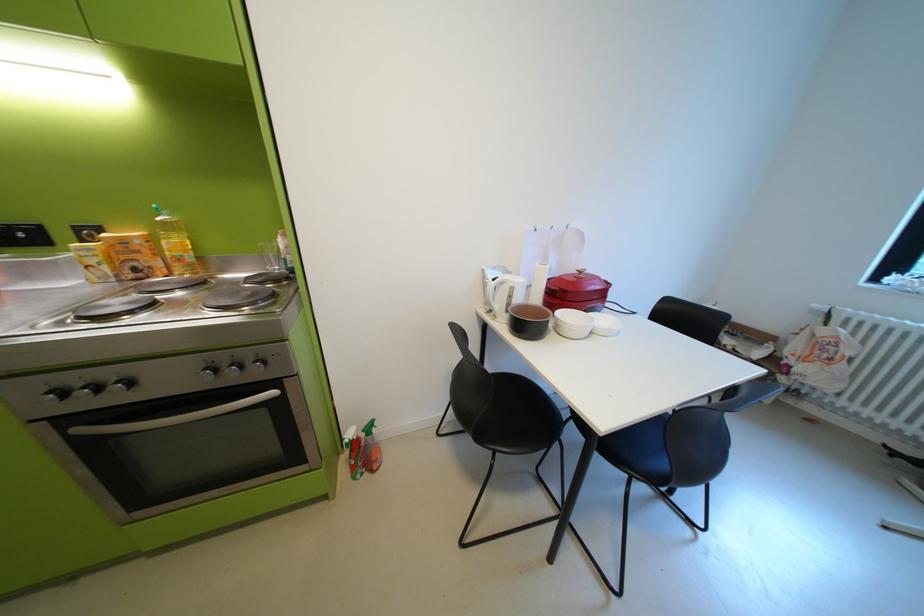
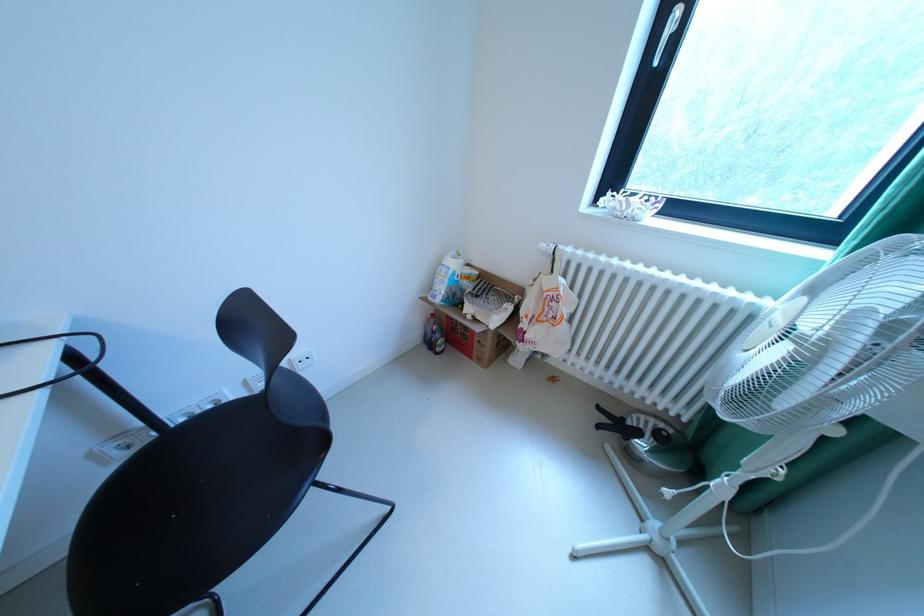
The point at [835,358] is marked in the first image. Where is the corresponding point in the second image?

(561, 317)